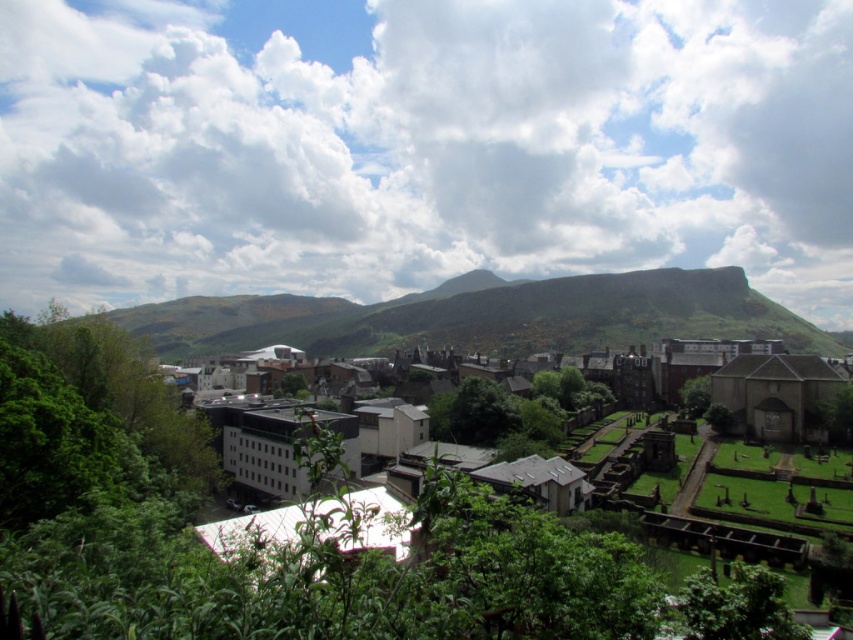
Question: Which point is farther from the camera taking this photo?

Choices:
 (A) click(x=769, y=253)
 (B) click(x=494, y=428)

Answer: (A)

Question: From the image, what is the correct spatial relationship of white fluffy cloud at upper center in relation to white matte building at center?

Choices:
 (A) left
 (B) right

Answer: (A)

Question: Does white fluffy cloud at upper center have a smaller size compared to white matte building at center?

Choices:
 (A) yes
 (B) no

Answer: (B)

Question: Observing the image, what is the correct spatial positioning of white fluffy cloud at upper center in reference to white matte building at center?

Choices:
 (A) below
 (B) above

Answer: (B)